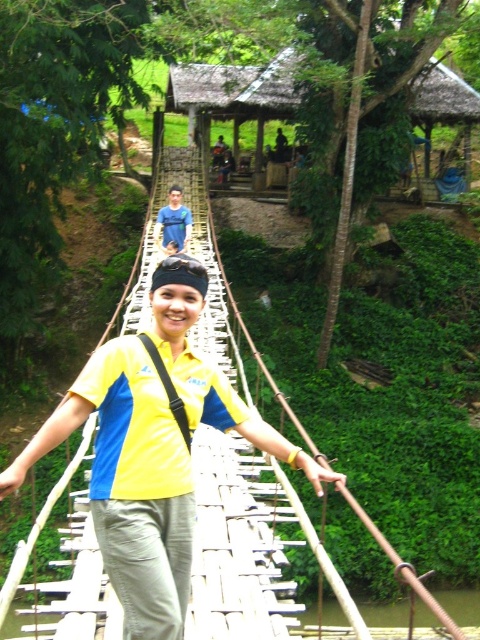
Question: Which point appears closest to the camera in this image?

Choices:
 (A) (394, 620)
 (B) (175, 227)

Answer: (B)

Question: Can you confirm if brown wooden bridge at center is bigger than blue denim jeans at center?

Choices:
 (A) no
 (B) yes

Answer: (B)

Question: Is brown wooden bridge at center bigger than blue denim jeans at center?

Choices:
 (A) yes
 (B) no

Answer: (A)

Question: Which object is farther from the camera taking this photo?

Choices:
 (A) brown wooden bridge at center
 (B) blue denim jeans at center

Answer: (B)

Question: Which object appears closest to the camera in this image?

Choices:
 (A) brown wooden bridge at center
 (B) blue denim jeans at center

Answer: (A)

Question: Is brown wooden bridge at center above blue denim jeans at center?

Choices:
 (A) no
 (B) yes

Answer: (A)